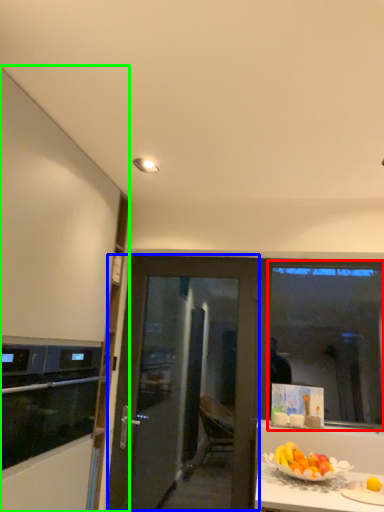
Question: Which object is positioned farthest from window screen (highlighted by a red box)? Select from door (highlighted by a blue box) and cabinetry (highlighted by a green box).

Choices:
 (A) door
 (B) cabinetry

Answer: (B)